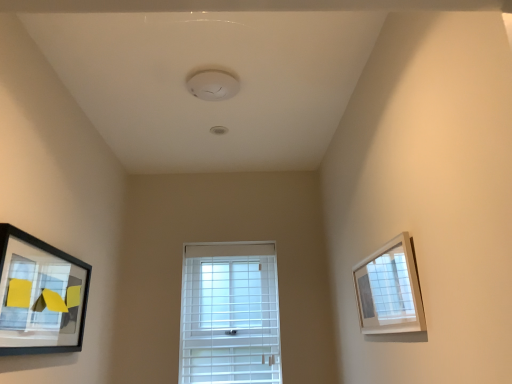
Question: From a real-world perspective, is white plastic window at center above or below matte black picture frame at left, which is counted as the 2th picture frame, starting from the right?

Choices:
 (A) below
 (B) above

Answer: (A)

Question: Visually, is white plastic window at center positioned to the left or to the right of matte black picture frame at left, positioned as the 1th picture frame in left-to-right order?

Choices:
 (A) left
 (B) right

Answer: (B)

Question: Considering the real-world distances, which object is closest to the matte black picture frame at left, which is counted as the 2th picture frame, starting from the right?

Choices:
 (A) white plastic window at center
 (B) white matte picture frame at upper right, acting as the 1th picture frame starting from the right

Answer: (A)

Question: Which is farther from the white plastic window at center?

Choices:
 (A) white matte picture frame at upper right, which ranks as the 2th picture frame in left-to-right order
 (B) matte black picture frame at left, which is counted as the 2th picture frame, starting from the right

Answer: (A)